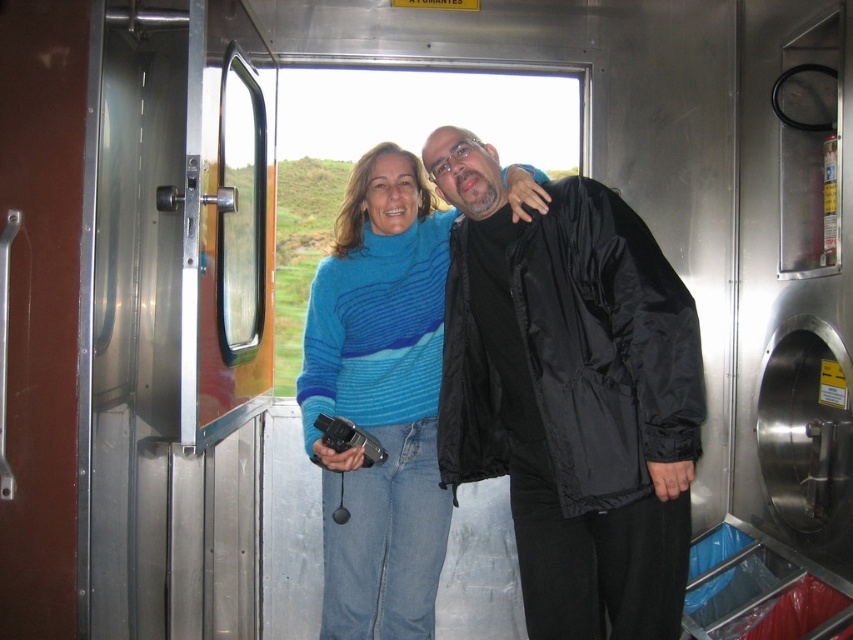
Which is more to the left, matte black jacket at center or blue striped sweater at center?

blue striped sweater at center is more to the left.

Is point (637, 372) closer to viewer compared to point (346, 625)?

Yes, point (637, 372) is closer to viewer.

Image resolution: width=853 pixels, height=640 pixels. In order to click on matte black jacket at center in this screenshot , I will do `click(572, 394)`.